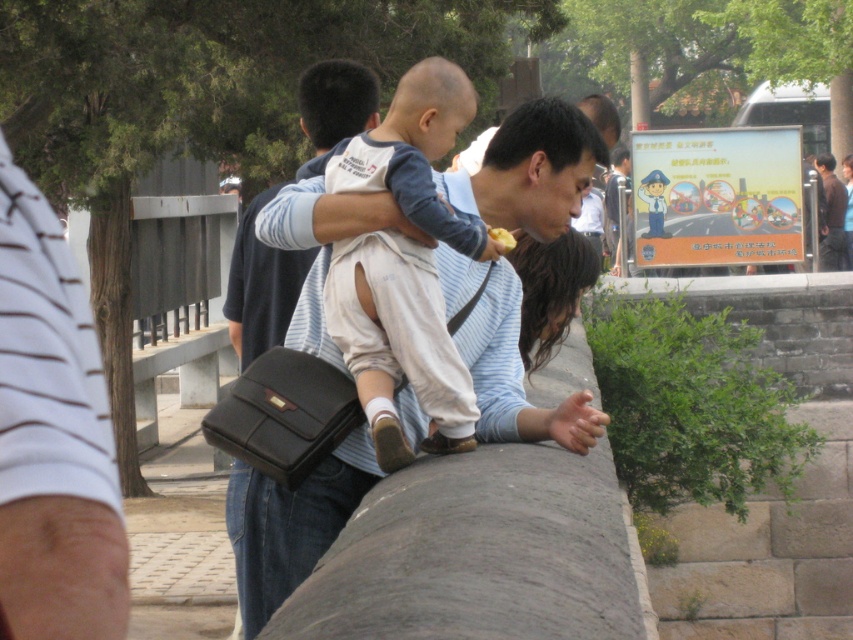
Where is the light blue striped shirt at center located in the image?

The light blue striped shirt at center is located at point (291, 524).

You are a photographer trying to capture the scene of the man and the child. You need to ensure that both the light beige cotton pants at center and the dark brown hair at center are in focus. Given that your camera can only focus on objects within a 30 inch range, will both objects be in focus?

The light beige cotton pants at center is 32.52 inches from the dark brown hair at center. Since the distance between them exceeds the 30 inch focus range, the camera cannot keep both in focus simultaneously.

You are a photographer trying to capture the scene described. You notice the light blue striped shirt at center and the brown leather jacket at upper right. Which object should you focus on first if you want to photograph the shorter one?

The light blue striped shirt at center has a lesser height compared to the brown leather jacket at upper right, so you should focus on the light blue striped shirt at center first.